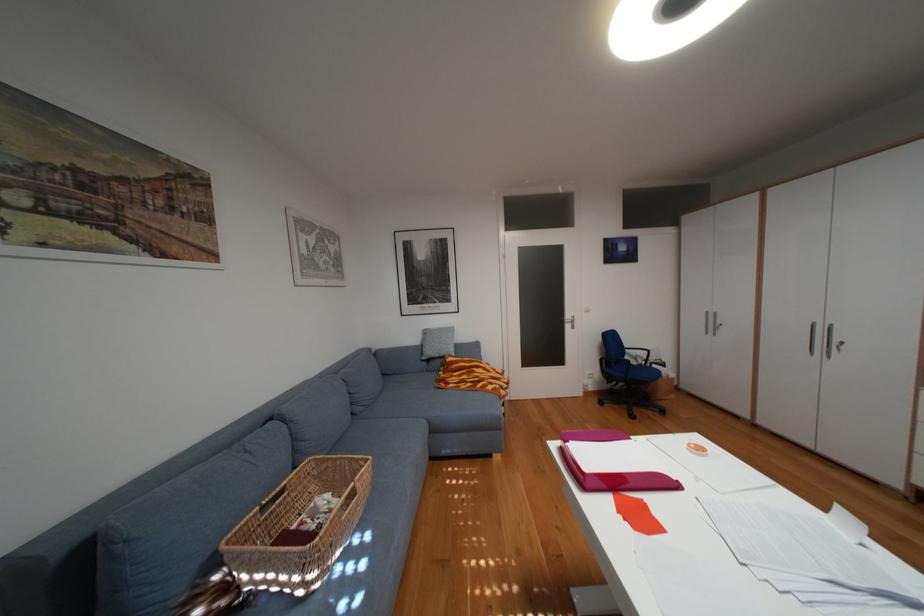
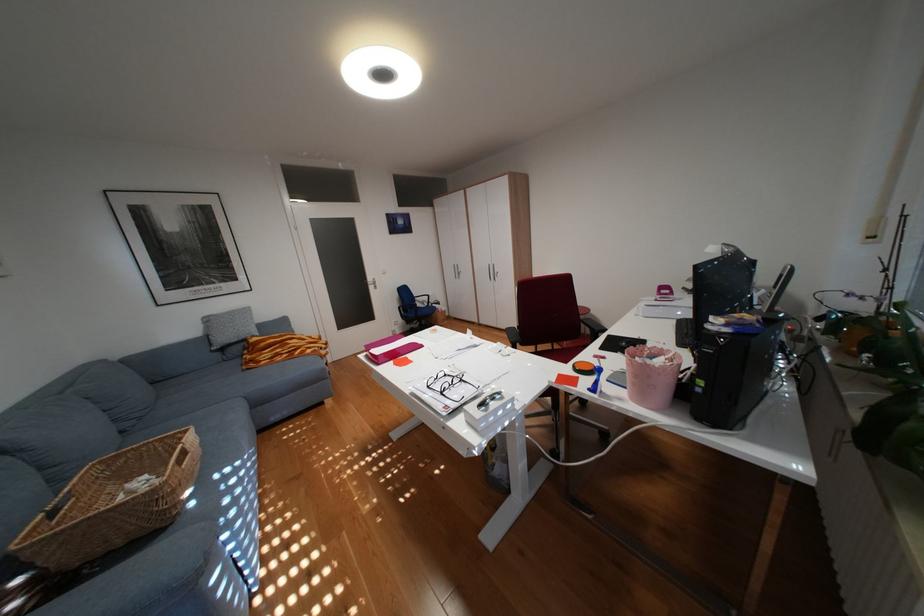
Question: The camera is either moving clockwise (left) or counter-clockwise (right) around the object. The first image is from the beginning of the video and the second image is from the end. Is the camera moving left or right when shooting the video?

Choices:
 (A) Left
 (B) Right

Answer: (A)